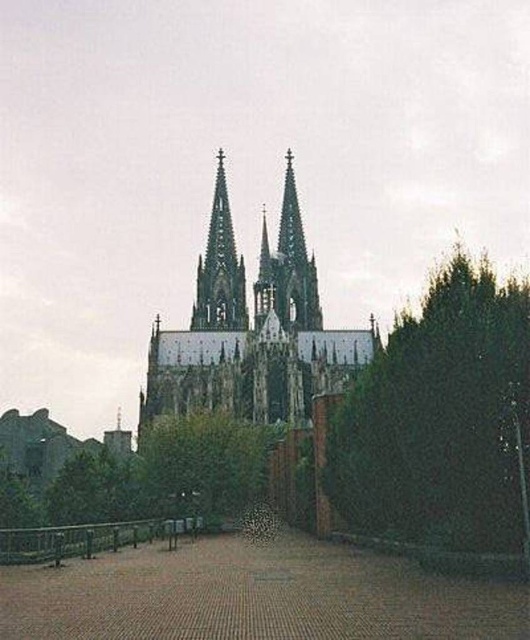
You are a tourist standing on the paved walkway leading to the stone gothic cathedral at center. You notice the smooth stone spire at center above you. Is the spire part of the cathedral or a separate structure?

The stone gothic cathedral at center is positioned under the smooth stone spire at center, so the spire is part of the cathedral.

You are a photographer planning to capture the cathedral and its surroundings. You want to ensure both the green leafy tree at right and the smooth stone spire at center are clearly visible in your shot. Considering their sizes, which object should you position closer to the edge of the frame to avoid overcrowding the composition?

The green leafy tree at right has a larger width than the smooth stone spire at center. To avoid overcrowding, position the green leafy tree at right closer to the edge of the frame since it is wider and requires more space in the composition.

You are standing on the paved walkway leading to the cathedral. You notice a green leafy tree at right and a smooth stone spire at center. Which object is taller?

The green leafy tree at right is taller than the smooth stone spire at center.